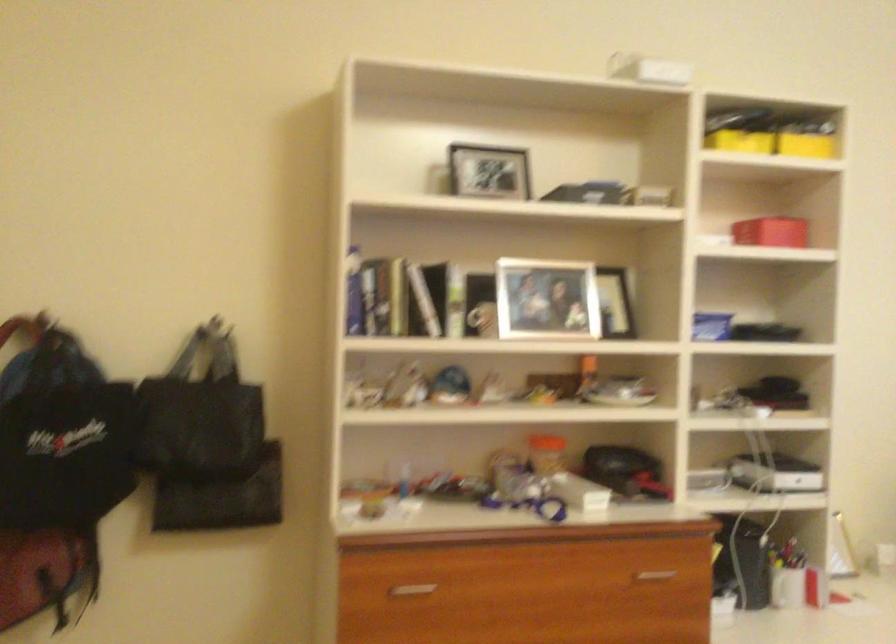
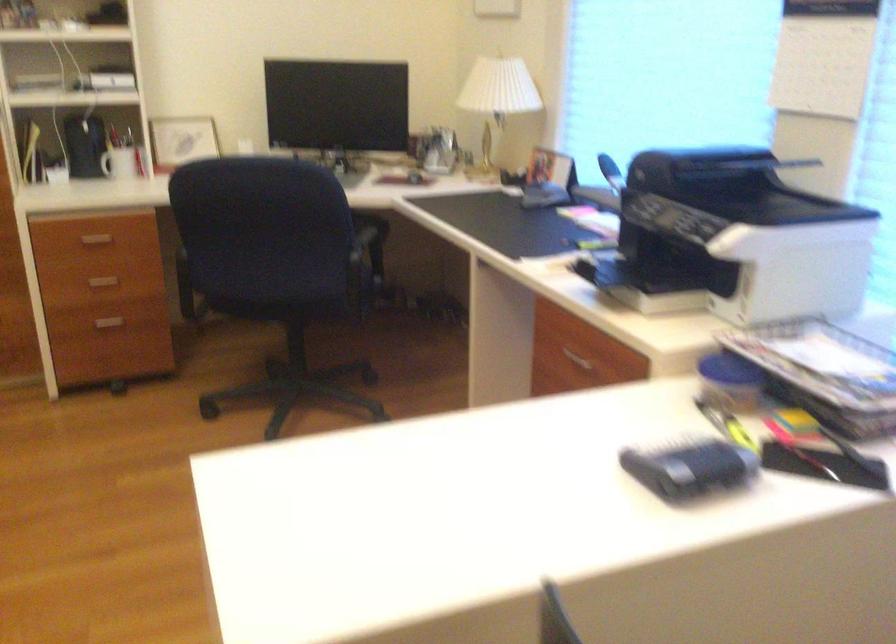
Which direction would the cameraman need to move to produce the second image?

The movement direction of the cameraman is right, backward.